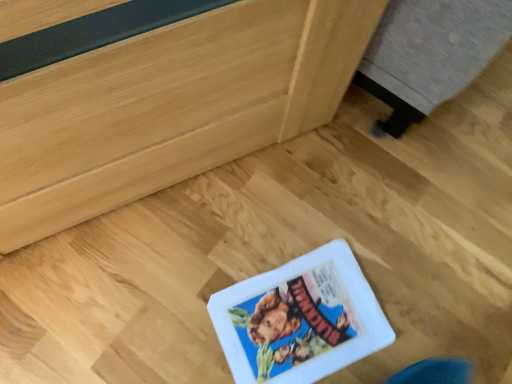
Locate an element on the screen. free space above white glossy book at center (from a real-world perspective) is located at coordinates (297, 320).